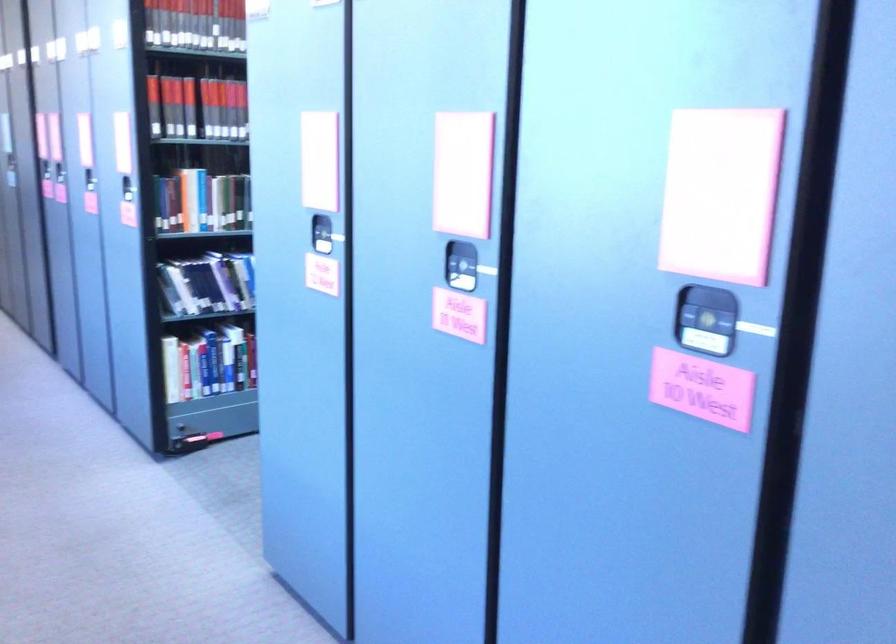
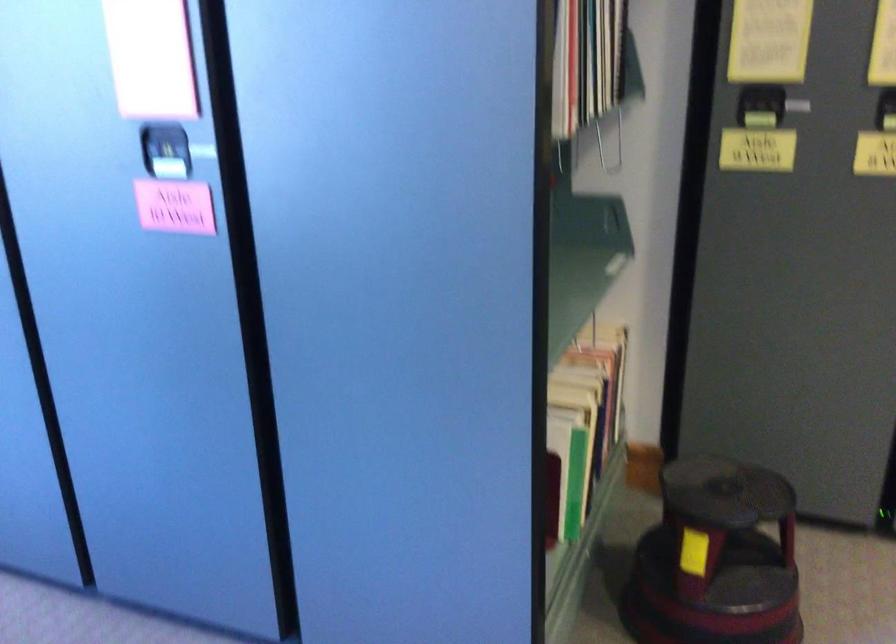
Find the pixel in the second image that matches [702,324] in the first image.

(165, 151)